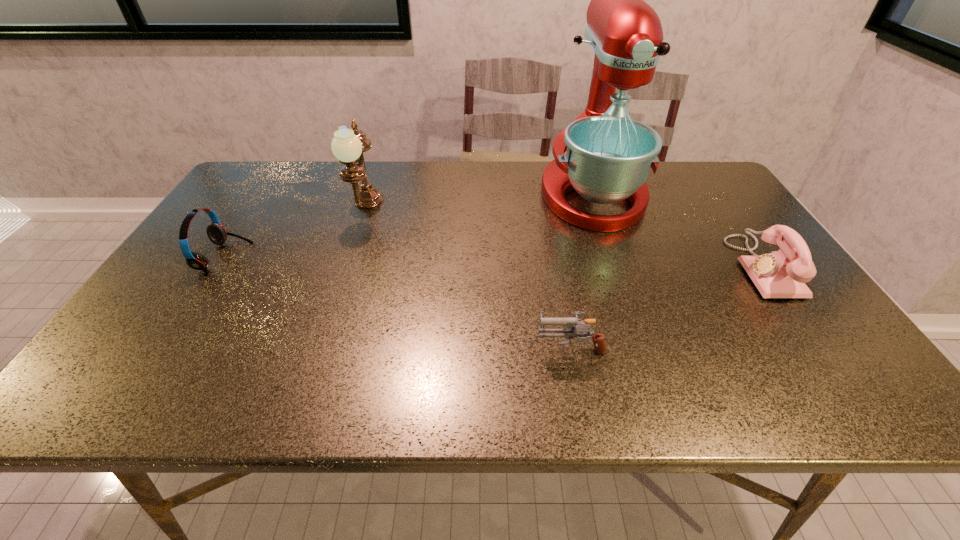
Find the location of a particular element. This screenshot has width=960, height=540. free location located on the dial of the rightmost object is located at coordinates (635, 267).

Identify the location of vacant position located on the dial of the rightmost object. tap(719, 267).

Where is `vacant space located with the microphone attached to the side of the headset`? This screenshot has width=960, height=540. vacant space located with the microphone attached to the side of the headset is located at coordinates (273, 257).

The width and height of the screenshot is (960, 540). I want to click on vacant space located at the barrel end of the nearest object, so click(x=503, y=347).

Image resolution: width=960 pixels, height=540 pixels. I want to click on free space located at the barrel end of the nearest object, so click(429, 347).

Where is `vacant space situated at the barrel end of the nearest object`? Image resolution: width=960 pixels, height=540 pixels. vacant space situated at the barrel end of the nearest object is located at coordinates (373, 347).

Locate an element on the screen. The image size is (960, 540). mixer located in the far edge section of the desktop is located at coordinates (608, 157).

The image size is (960, 540). I want to click on oil lamp that is at the far edge, so click(x=348, y=145).

This screenshot has height=540, width=960. In order to click on object at the left edge in this screenshot , I will do `click(217, 234)`.

The width and height of the screenshot is (960, 540). Identify the location of object that is at the right edge. (781, 274).